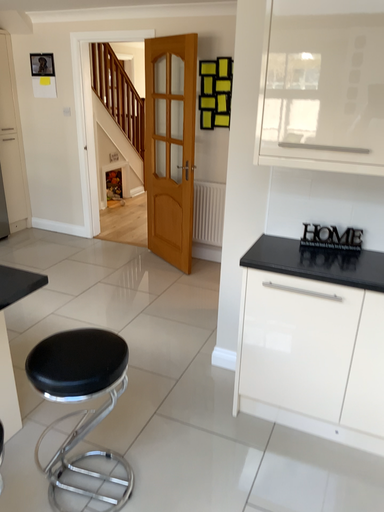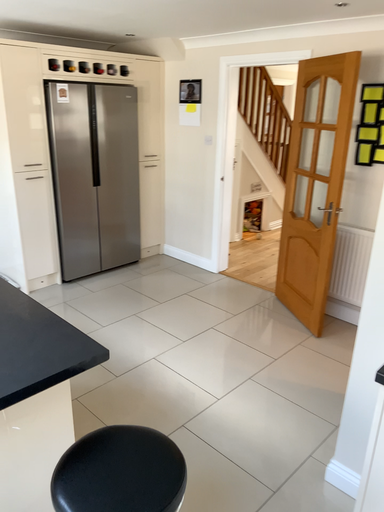
Question: How did the camera likely rotate when shooting the video?

Choices:
 (A) rotated left
 (B) rotated right

Answer: (A)